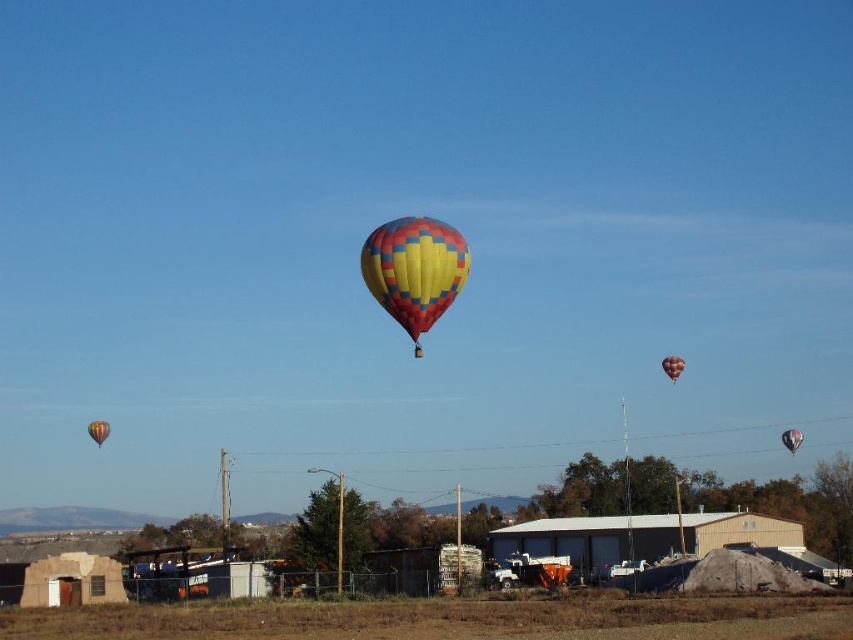
You are a pilot preparing to land your hot air balloon. You see the multicolored fabric hot air balloon at upper center and the multicolored fabric balloon at center in the sky. Which one is higher and needs to be avoided for a safe landing?

The multicolored fabric hot air balloon at upper center is above the multicolored fabric balloon at center, so it is higher and needs to be avoided for a safe landing.

You are a photographer trying to capture the multicolored fabric balloon at center without the orange fabric balloon at center blocking it. What should you do?

The multicolored fabric balloon at center is behind the orange fabric balloon at center, so you should move your position to find an angle where the orange fabric balloon at center no longer obstructs the view of the multicolored one.